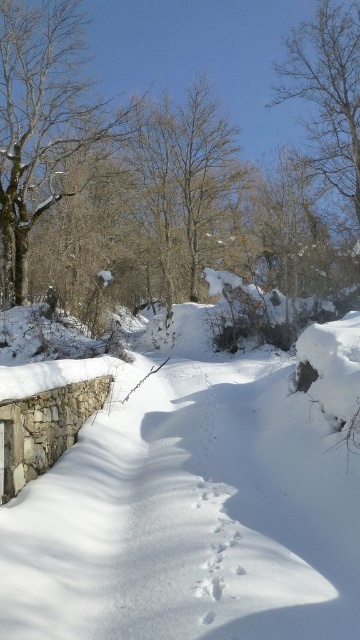
Question: Does white powdery snow at center come in front of brown textured tree at center?

Choices:
 (A) yes
 (B) no

Answer: (A)

Question: Can you confirm if white powdery snow at center is wider than brown textured tree at center?

Choices:
 (A) yes
 (B) no

Answer: (B)

Question: Is white powdery snow at center to the right of brown textured tree at upper right from the viewer's perspective?

Choices:
 (A) no
 (B) yes

Answer: (A)

Question: Which point is closer to the camera?

Choices:
 (A) (0, 547)
 (B) (206, 218)

Answer: (A)

Question: Based on their relative distances, which object is nearer to the brown textured tree at upper right?

Choices:
 (A) brown textured tree at center
 (B) white powdery snow at center

Answer: (A)

Question: Which object appears farthest from the camera in this image?

Choices:
 (A) white powdery snow at center
 (B) brown textured tree at upper right
 (C) brown textured tree at center

Answer: (B)